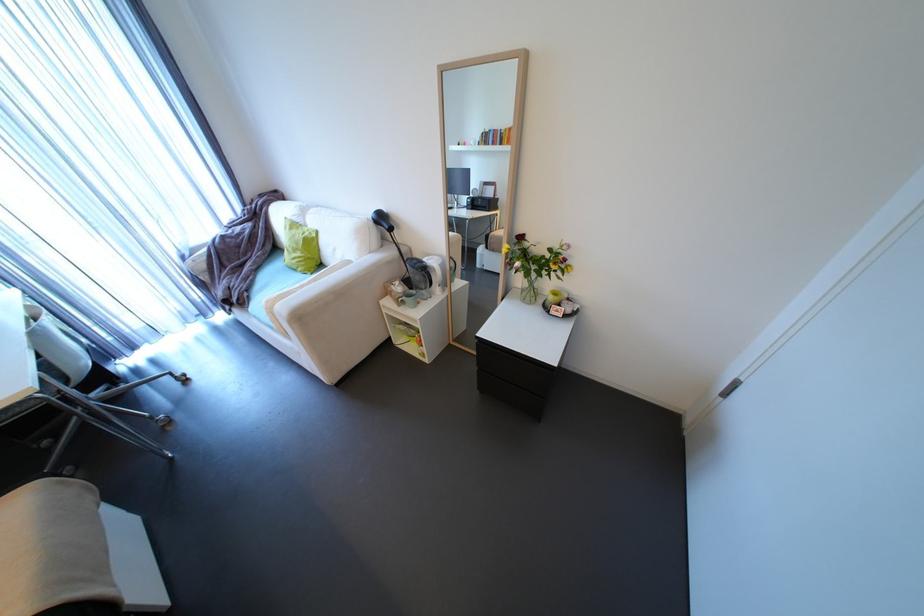
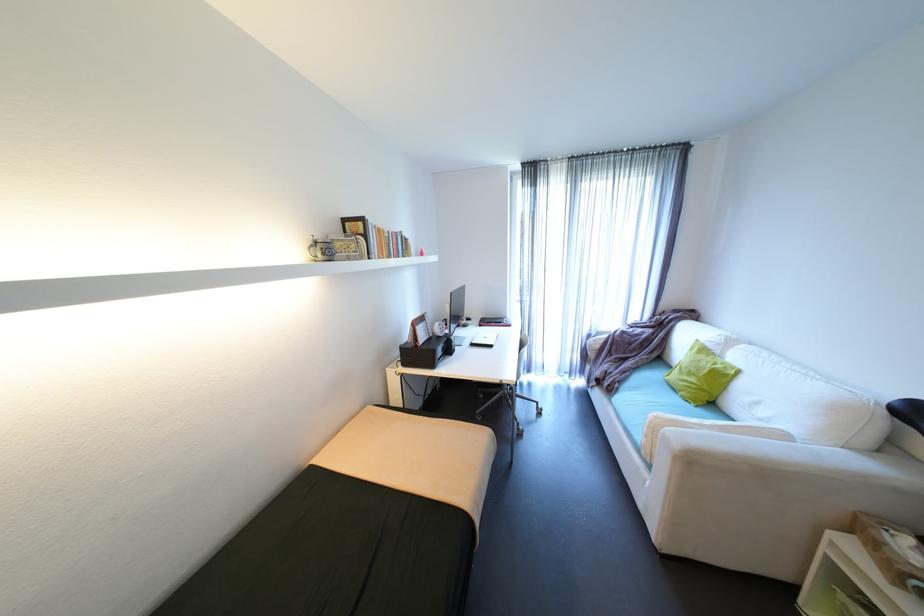
Question: How did the camera likely rotate?

Choices:
 (A) Left
 (B) Right
 (C) Up
 (D) Down

Answer: (A)